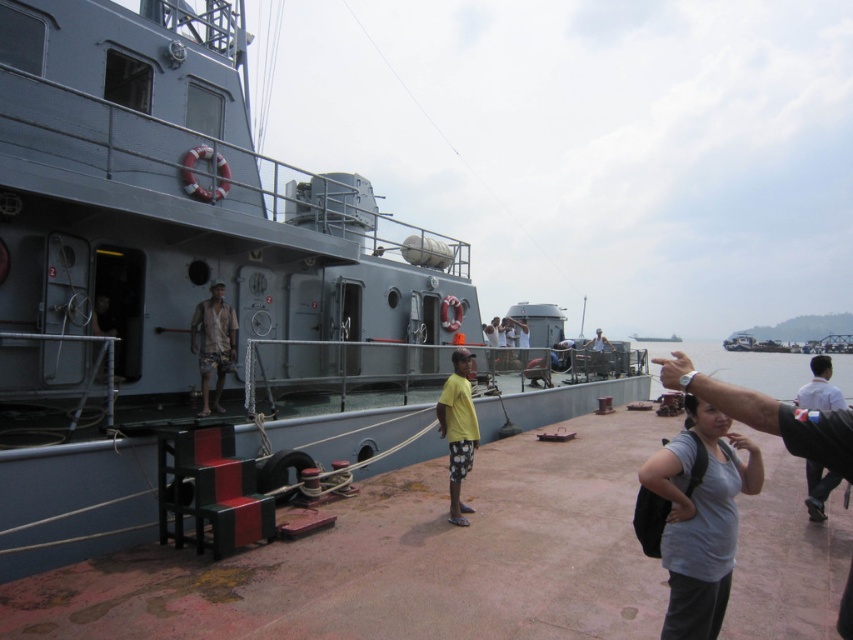
You are a photographer standing on the dock. You want to take a photo of the gray matte boat at center and the camouflage shorts at center. Which object should you focus on first if you want to capture both in a single frame without moving the camera?

You should focus on the gray matte boat at center first because it is taller than the camouflage shorts at center, allowing it to be in the frame while adjusting the camera angle to include both.

You are standing on the dock and see two people wearing the yellow matte shirt at center and the white shirt at right. Which person is positioned closer to the ship?

The yellow matte shirt at center is positioned closer to the ship because it is to the left of the white shirt at right, and the woman with the backpack is facing towards the ship.

You are a photographer trying to capture both the gray matte boat at center and the yellow matte shirt at center in a single frame. Since the boat is larger, where should you position yourself relative to the shirt to ensure both are visible in the photo?

To capture both the gray matte boat at center and the yellow matte shirt at center in the same frame, you should move closer to the yellow matte shirt at center. This will make the shirt appear larger in the photo, balancing its size with the larger gray matte boat at center in the background.